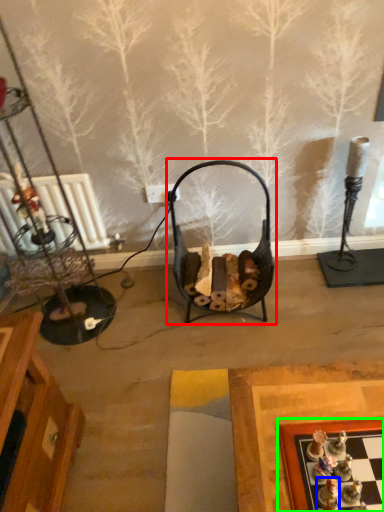
Question: Which object is positioned farthest from swivel chair (highlighted by a red box)? Select from toy (highlighted by a blue box) and board game (highlighted by a green box).

Choices:
 (A) toy
 (B) board game

Answer: (A)